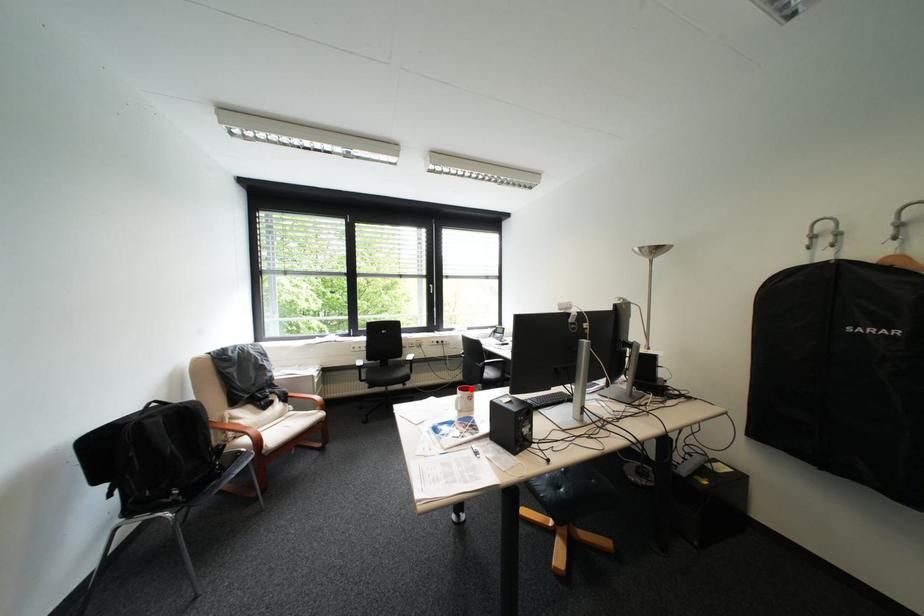
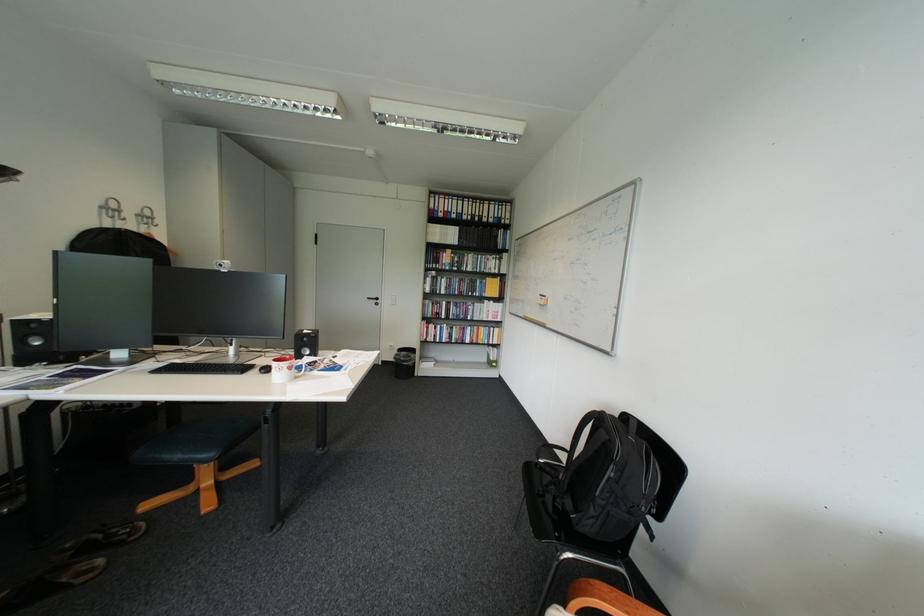
Question: I am providing you with two images of the same scene from different viewpoints. In image1, a red point is highlighted. Considering the same 3D point in image2, which of the following is correct?

Choices:
 (A) It is closer
 (B) It is farther

Answer: (B)